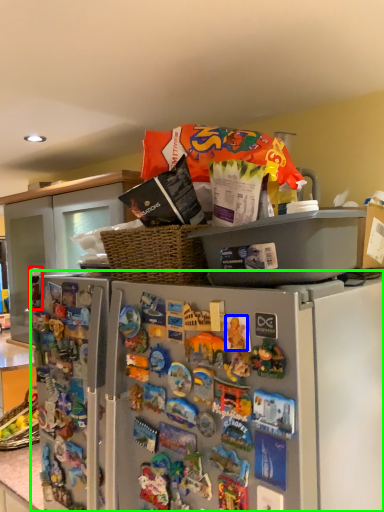
Question: Which object is positioned farthest from toy (highlighted by a red box)? Select from toy (highlighted by a blue box) and refrigerator (highlighted by a green box).

Choices:
 (A) toy
 (B) refrigerator

Answer: (A)